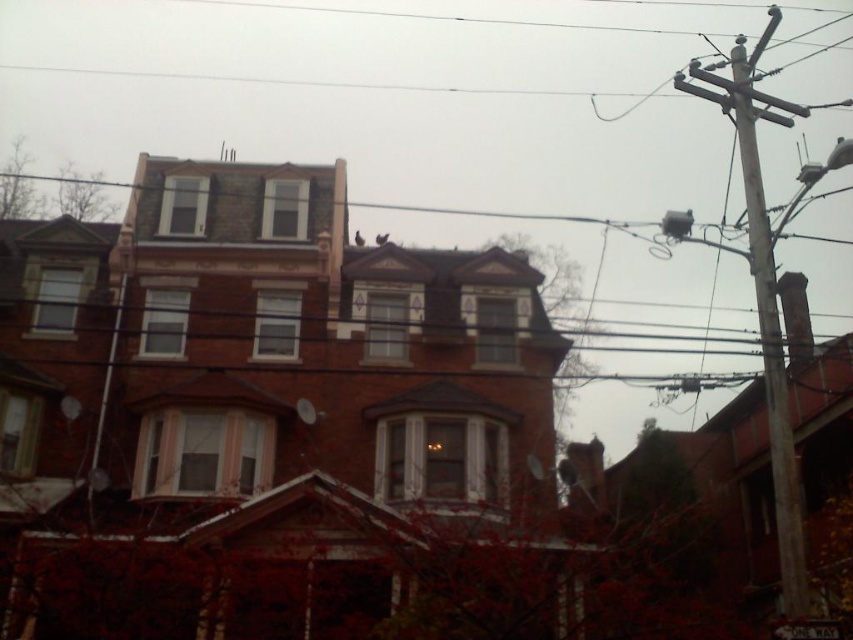
Question: Can you confirm if wooden utility pole at right is thinner than white plastic street sign at upper center?

Choices:
 (A) yes
 (B) no

Answer: (B)

Question: Which object appears closest to the camera in this image?

Choices:
 (A) wooden utility pole at right
 (B) white plastic street sign at upper center

Answer: (B)

Question: Where is wooden utility pole at right located in relation to white plastic street sign at upper center in the image?

Choices:
 (A) right
 (B) left

Answer: (A)

Question: Which point appears farthest from the camera in this image?

Choices:
 (A) (817, 634)
 (B) (773, 385)

Answer: (B)

Question: Is wooden utility pole at right positioned in front of white plastic street sign at upper center?

Choices:
 (A) yes
 (B) no

Answer: (B)

Question: Which point is closer to the camera?

Choices:
 (A) (825, 634)
 (B) (793, 499)

Answer: (A)